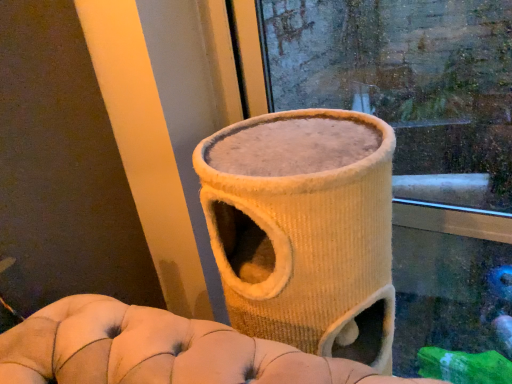
What do you see at coordinates (307, 246) in the screenshot? This screenshot has height=384, width=512. I see `beige tufted bean bag chair at center` at bounding box center [307, 246].

I want to click on beige tufted bean bag chair at center, so click(x=307, y=246).

Find the location of a particular element. This screenshot has height=384, width=512. beige tufted bean bag chair at center is located at coordinates (307, 246).